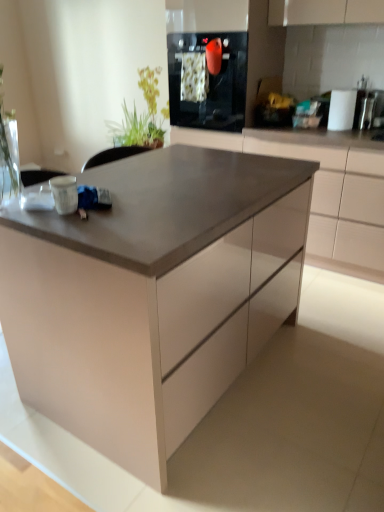
Question: Does green leafy plant at upper left have a lesser height compared to matte gray table at center?

Choices:
 (A) yes
 (B) no

Answer: (A)

Question: Considering the relative sizes of green leafy plant at upper left and matte gray table at center in the image provided, is green leafy plant at upper left wider than matte gray table at center?

Choices:
 (A) no
 (B) yes

Answer: (A)

Question: Is green leafy plant at upper left smaller than matte gray table at center?

Choices:
 (A) yes
 (B) no

Answer: (A)

Question: Considering the relative sizes of green leafy plant at upper left and matte gray table at center in the image provided, is green leafy plant at upper left thinner than matte gray table at center?

Choices:
 (A) yes
 (B) no

Answer: (A)

Question: Would you say green leafy plant at upper left is a long distance from matte gray table at center?

Choices:
 (A) no
 (B) yes

Answer: (B)

Question: Does green leafy plant at upper left touch matte gray table at center?

Choices:
 (A) yes
 (B) no

Answer: (B)

Question: Does black glass oven at upper center touch matte white cabinet at center?

Choices:
 (A) yes
 (B) no

Answer: (B)

Question: Is black glass oven at upper center to the right of matte white cabinet at center from the viewer's perspective?

Choices:
 (A) no
 (B) yes

Answer: (A)

Question: Is black glass oven at upper center outside of matte white cabinet at center?

Choices:
 (A) no
 (B) yes

Answer: (B)

Question: Is black glass oven at upper center smaller than matte white cabinet at center?

Choices:
 (A) no
 (B) yes

Answer: (B)

Question: Considering the relative sizes of black glass oven at upper center and matte white cabinet at center in the image provided, is black glass oven at upper center thinner than matte white cabinet at center?

Choices:
 (A) yes
 (B) no

Answer: (A)

Question: Is black glass oven at upper center further to the viewer compared to matte white cabinet at center?

Choices:
 (A) no
 (B) yes

Answer: (B)

Question: From the image's perspective, is matte gray table at center on top of black glass oven at upper center?

Choices:
 (A) yes
 (B) no

Answer: (B)